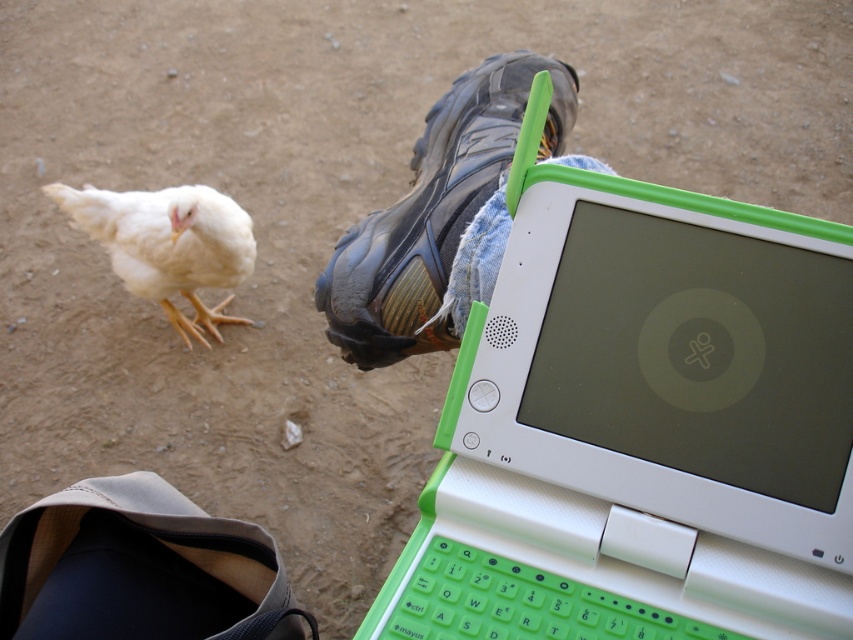
You are a photographer trying to capture a clear image of the green plastic laptop at center and the white feathered chicken at lower left. Which object should you focus on first to ensure both are in focus?

The green plastic laptop at center is in front of the white feathered chicken at lower left, so you should focus on the green plastic laptop at center first to ensure both are in focus.

You are a delivery person who needs to place a package between the green plastic laptop at center and the white feathered chicken at lower left. The package requires a minimum of 5 feet of space to be safely placed. Can you fit the package between them?

The distance between the green plastic laptop at center and the white feathered chicken at lower left is 4.33 feet, which is less than the required 5 feet. Therefore, the package cannot be safely placed between them.

You are trying to locate the point at coordinates [605,458] in the image. According to the scene description, where is this point located?

The point at coordinates [605,458] is on the green plastic laptop at center.